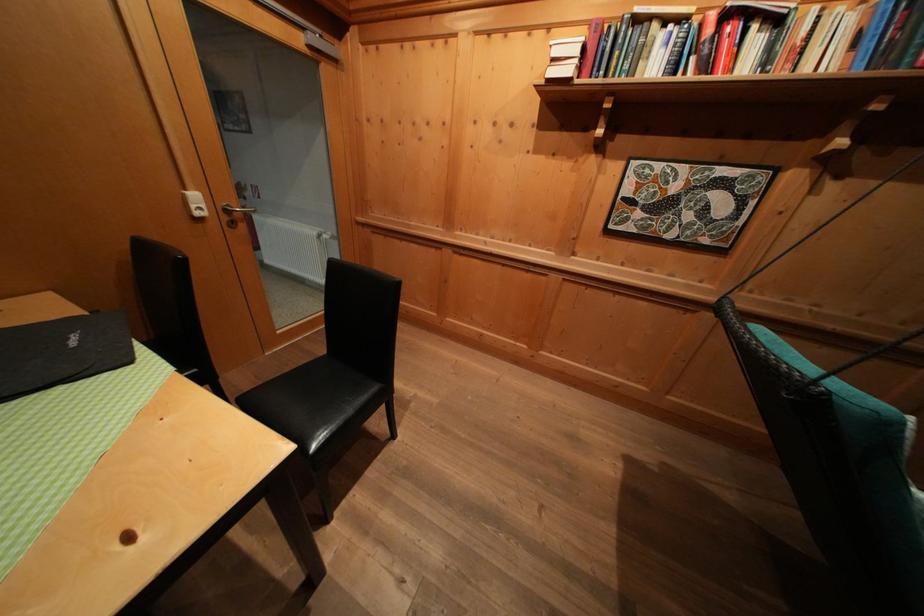
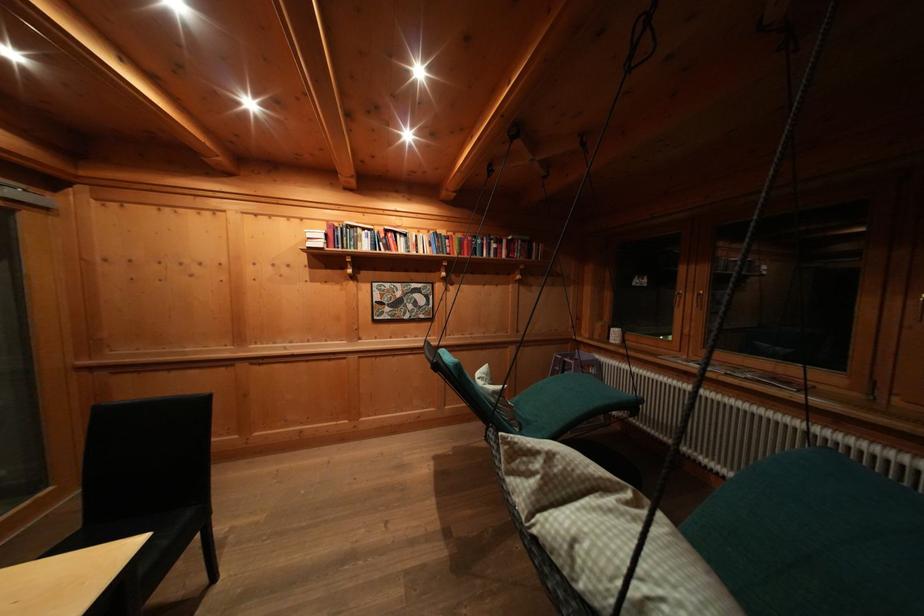
Question: How did the camera likely rotate?

Choices:
 (A) Left
 (B) Right
 (C) Up
 (D) Down

Answer: (B)